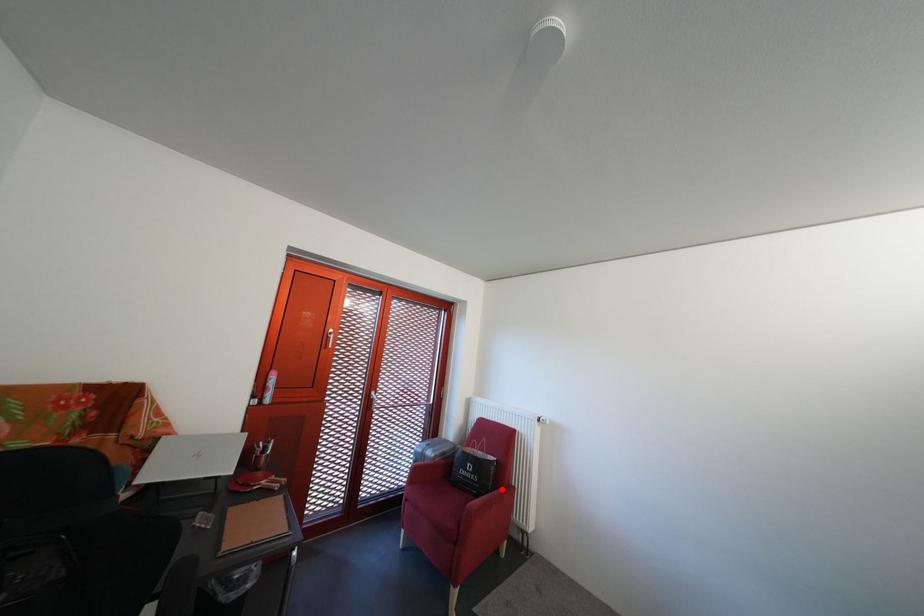
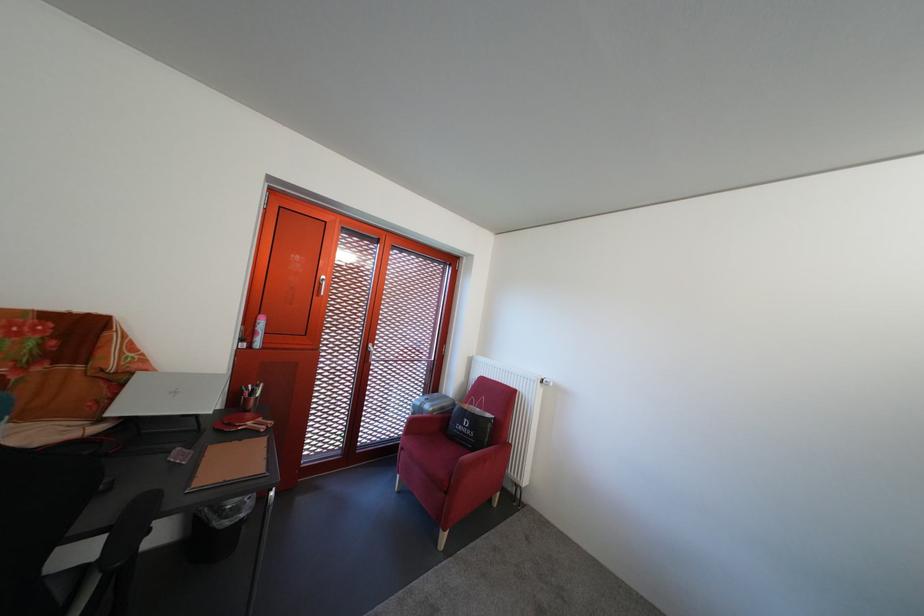
Find the pixel in the second image that matches the highlighted location in the first image.

(497, 446)